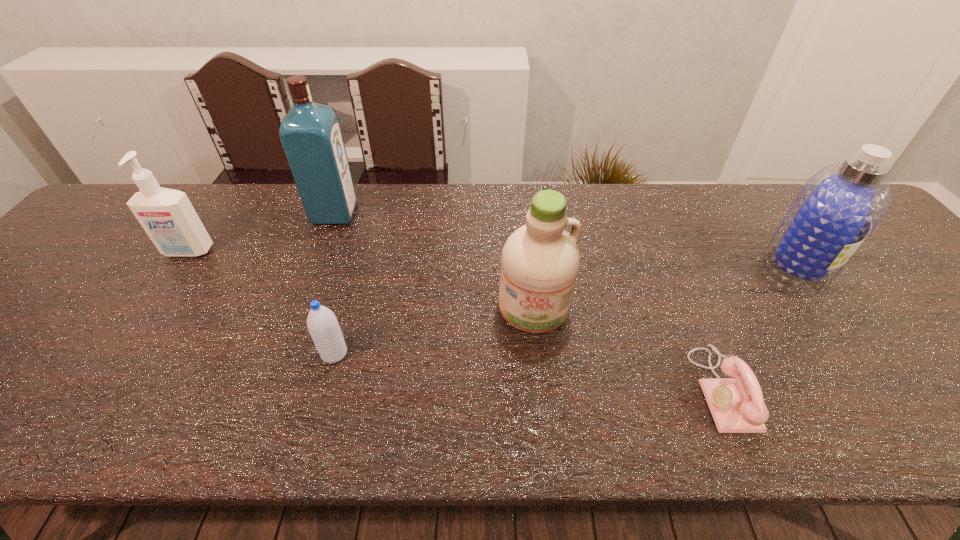
This screenshot has width=960, height=540. What are the coordinates of `vacant point at the near edge` in the screenshot? It's located at (220, 434).

You are a GUI agent. You are given a task and a screenshot of the screen. Output one action in this format:
    pyautogui.click(x=<x>, y=<y>)
    Task: Click on the free space at the left edge
    This screenshot has height=540, width=960.
    Given the screenshot: What is the action you would take?
    pyautogui.click(x=132, y=241)

You are a GUI agent. You are given a task and a screenshot of the screen. Output one action in this format:
    pyautogui.click(x=<x>, y=<y>)
    Task: Click on the blank space at the far left corner
    
    Given the screenshot: What is the action you would take?
    pyautogui.click(x=129, y=200)

What are the coordinates of `vacant area between the second cleansing agent from left to right and the rightmost cleansing agent` in the screenshot? It's located at (663, 288).

You are a GUI agent. You are given a task and a screenshot of the screen. Output one action in this format:
    pyautogui.click(x=<x>, y=<y>)
    Task: Click on the vacant space that's between the leftmost cleansing agent and the liquor
    
    Given the screenshot: What is the action you would take?
    pyautogui.click(x=261, y=233)

The height and width of the screenshot is (540, 960). In order to click on free space between the second object from right to left and the rightmost object in this screenshot , I will do `click(758, 329)`.

The width and height of the screenshot is (960, 540). I want to click on vacant space in between the telephone and the third object from right to left, so click(628, 348).

Locate an element on the screen. empty space between the third object from right to left and the liquor is located at coordinates (434, 260).

Locate an element on the screen. This screenshot has width=960, height=540. vacant region between the rightmost object and the second cleansing agent from right to left is located at coordinates (663, 288).

The width and height of the screenshot is (960, 540). Find the location of `vacant point located between the telephone and the second cleansing agent from left to right`. vacant point located between the telephone and the second cleansing agent from left to right is located at coordinates 628,348.